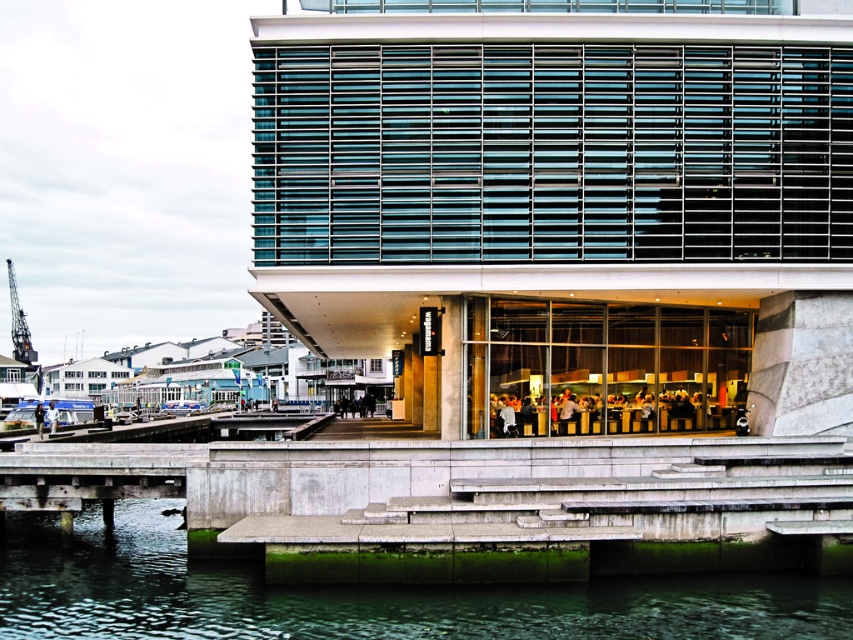
Question: Can you confirm if green algae-covered concrete at lower center is bigger than white fabric person at lower center?

Choices:
 (A) no
 (B) yes

Answer: (A)

Question: Estimate the real-world distances between objects in this image. Which object is farther from the white fabric person at lower left?

Choices:
 (A) matte black people at center
 (B) white fabric person at lower center

Answer: (A)

Question: Which object is positioned closest to the matte black people at center?

Choices:
 (A) metallic gray crane at left
 (B) white fabric person at lower center

Answer: (B)

Question: Is matte black sign at center to the left of white fabric person at lower left from the viewer's perspective?

Choices:
 (A) no
 (B) yes

Answer: (A)

Question: Is green algae-covered concrete at lower center to the right of metallic gray crane at left from the viewer's perspective?

Choices:
 (A) yes
 (B) no

Answer: (A)

Question: Which of these objects is positioned closest to the matte black sign at center?

Choices:
 (A) white fabric person at lower center
 (B) white fabric person at lower left

Answer: (A)